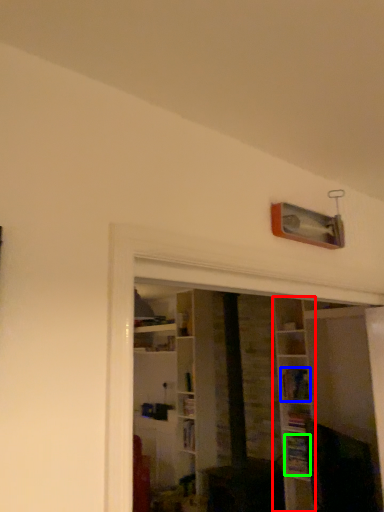
Question: Which is nearer to the shelf (highlighted by a red box)? book (highlighted by a blue box) or book (highlighted by a green box).

Choices:
 (A) book
 (B) book

Answer: (A)